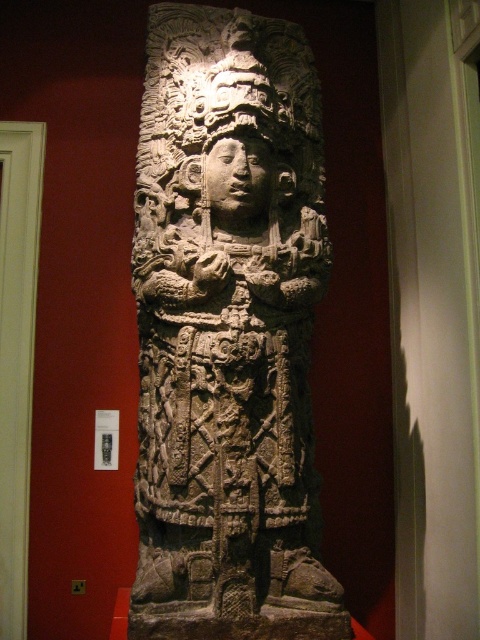
You are an art conservator examining the dark gray stone sculpture at center and the carved stone head at center in the museum. You need to determine the placement order of these two objects from top to bottom. Can you tell me which one is above the other?

The dark gray stone sculpture at center is positioned under the carved stone head at center, so the carved stone head at center is above the dark gray stone sculpture at center.

You are an art conservator working in a museum. You need to place a protective barrier between the dark gray stone sculpture at center and the carved stone head at center. What is the minimum width this barrier should be to ensure both objects are fully separated?

The minimum width of the barrier should be at least 7.85 inches to ensure the dark gray stone sculpture at center and the carved stone head at center are fully separated.

You are standing in front of the stone sculpture in the museum. You notice two points marked on the sculpture. The first point is at coordinates point (x=229, y=598) and the second is at point (x=226, y=186). Which of these two points is closer to you?

Point (x=229, y=598) is closer to the viewer than point (x=226, y=186).